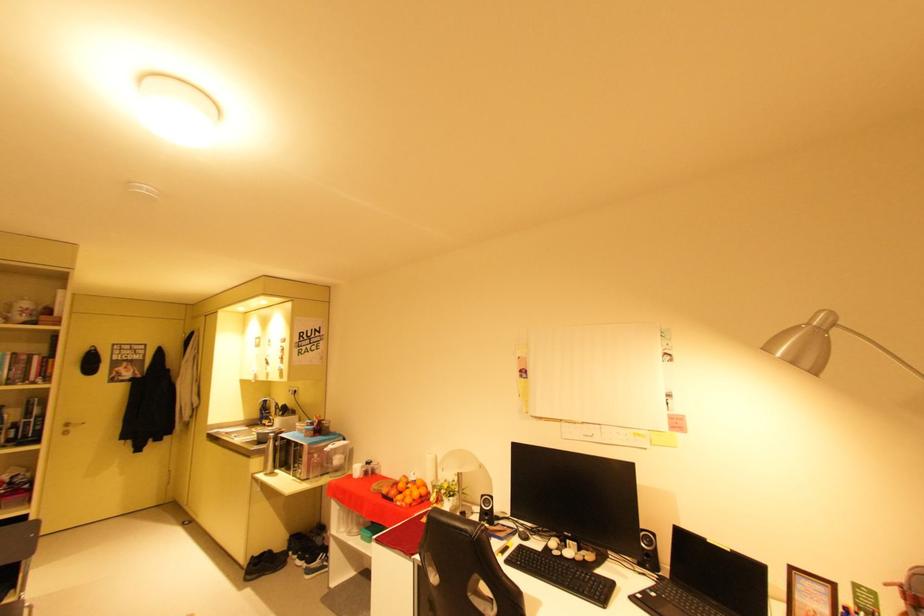
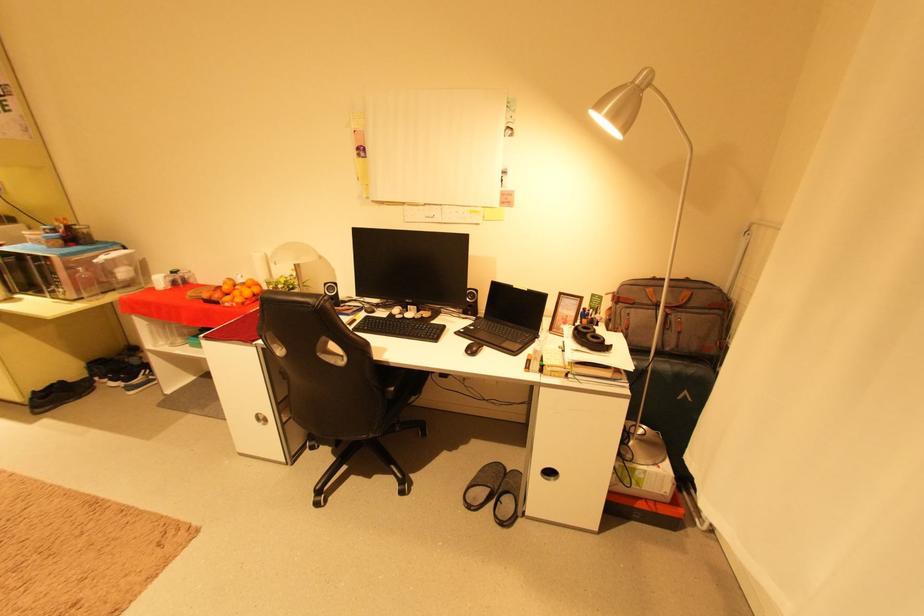
In the second image, find the point that corresponds to the point at 310,463 in the first image.

(66, 281)